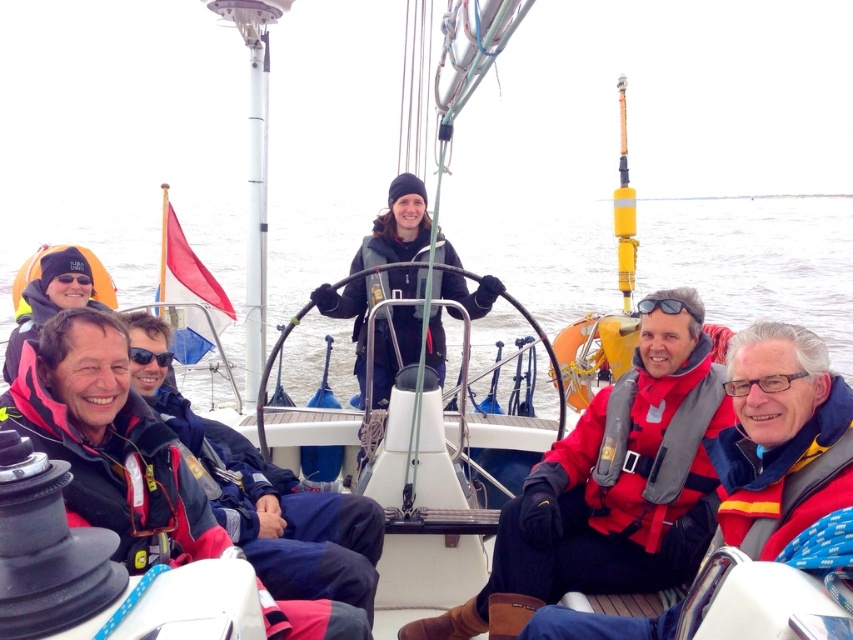
Is point (717, 476) positioned after point (33, 332)?

No, it is not.

Who is positioned more to the right, red matte life vest at center or pink fleece jacket at lower left?

Positioned to the right is red matte life vest at center.

What are the coordinates of `red matte life vest at center` in the screenshot? It's located at (614, 483).

Image resolution: width=853 pixels, height=640 pixels. What are the coordinates of `red matte life vest at center` in the screenshot? It's located at (614, 483).

Does clear water at center have a greater height compared to pink fleece jacket at lower left?

Correct, clear water at center is much taller as pink fleece jacket at lower left.

From the picture: Which is more to the right, clear water at center or pink fleece jacket at lower left?

pink fleece jacket at lower left is more to the right.

Which is in front, point (289, 358) or point (26, 333)?

Point (26, 333) is in front.

I want to click on clear water at center, so click(756, 260).

Is red matte life jacket at lower right wider than pink fleece jacket at lower left?

No.

Which is behind, point (608, 440) or point (15, 372)?

Positioned behind is point (15, 372).

Where is `red matte life jacket at lower right`? This screenshot has width=853, height=640. red matte life jacket at lower right is located at coordinates (657, 445).